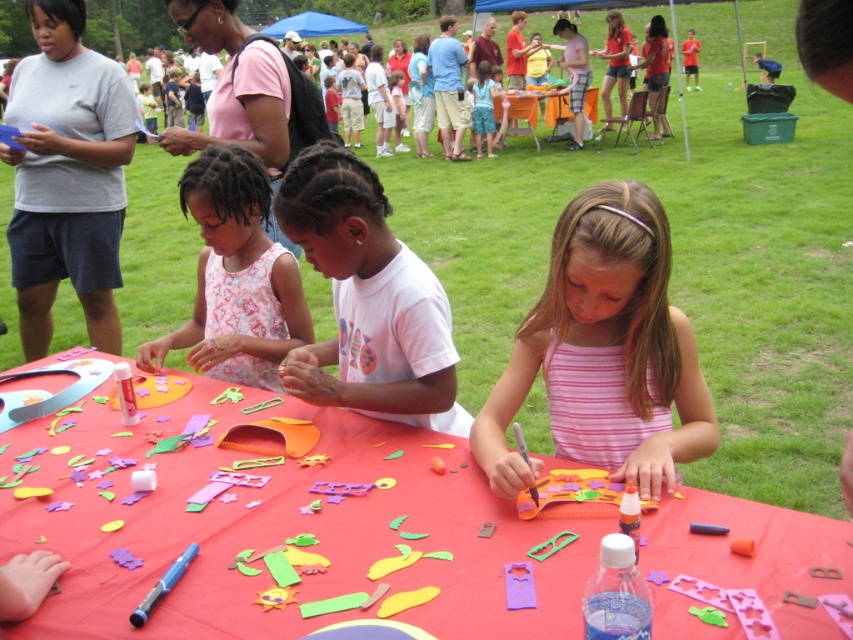
You are standing at the entrance of the festival and want to find the person wearing the pink striped tank top at center. According to the map, where should you look relative to the center of the image?

The pink striped tank top at center is located at point 0.550 on the x axis and 0.709 on the y axis, so you should look slightly to the right and above the center of the image.